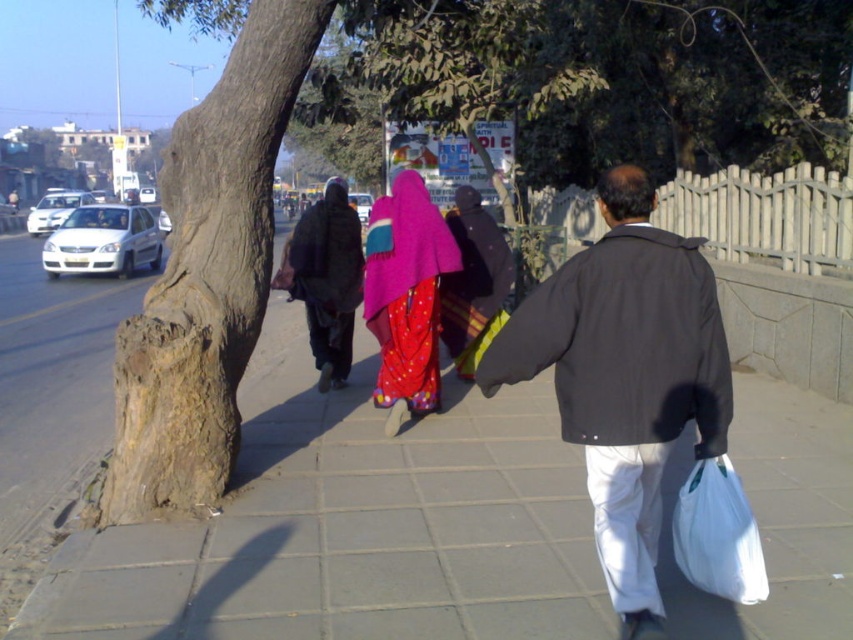
You are standing on the sidewalk and see the shiny pink fabric at center and the white plastic bag at lower right. Which object is closer to the fence on the left side of the sidewalk?

The shiny pink fabric at center is closer to the fence on the left side of the sidewalk because it is positioned to the left of the white plastic bag at lower right.

You are a pedestrian standing on the sidewalk and see the dark gray jacket at center and the dark brown fabric at center. Which one is closer to you?

The dark gray jacket at center is closer to you because it is in front of the dark brown fabric at center.

You are a pedestrian standing on the sidewalk and see the dark brown fabric at center and the white plastic bag at lower right. Which object is closer to you?

The dark brown fabric at center is closer to you because the white plastic bag at lower right is behind it.